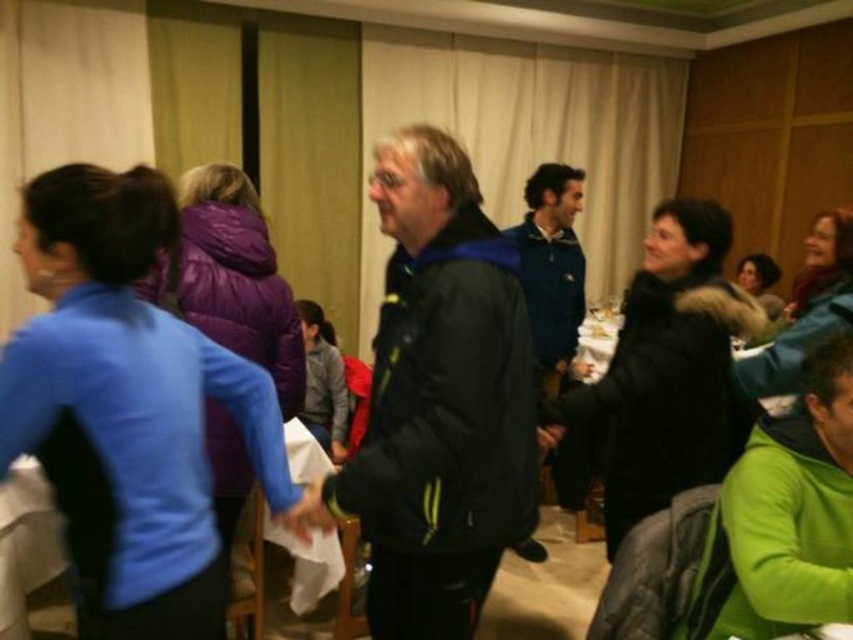
Does black jacket at center appear over white paper at center?

Yes.

Is point (415, 227) farther from camera compared to point (338, 580)?

That is False.

You are a GUI agent. You are given a task and a screenshot of the screen. Output one action in this format:
    pyautogui.click(x=<x>, y=<y>)
    Task: Click on the black jacket at center
    This screenshot has width=853, height=640.
    Given the screenshot: What is the action you would take?
    pyautogui.click(x=439, y=401)

Between point (409, 156) and point (546, 396), which one is positioned in front?

Point (409, 156)

You are a GUI agent. You are given a task and a screenshot of the screen. Output one action in this format:
    pyautogui.click(x=<x>, y=<y>)
    Task: Click on the black jacket at center
    The height and width of the screenshot is (640, 853).
    Given the screenshot: What is the action you would take?
    pyautogui.click(x=439, y=401)

Is green fleece jacket at lower right closer to camera compared to white paper at center?

Yes, it is in front of white paper at center.

Can you confirm if green fleece jacket at lower right is taller than white paper at center?

In fact, green fleece jacket at lower right may be shorter than white paper at center.

Is point (837, 548) positioned before point (306, 576)?

That is True.

Identify the location of green fleece jacket at lower right. (791, 512).